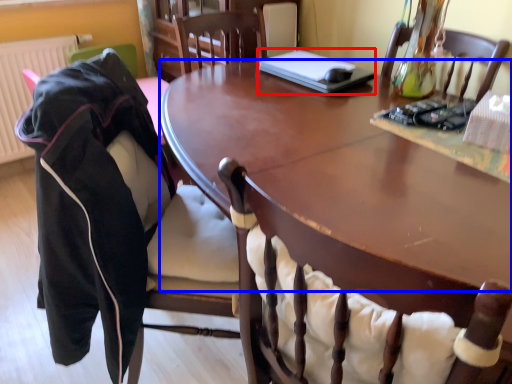
Question: Which object is closer to the camera taking this photo, laptop (highlighted by a red box) or table top (highlighted by a blue box)?

Choices:
 (A) laptop
 (B) table top

Answer: (B)